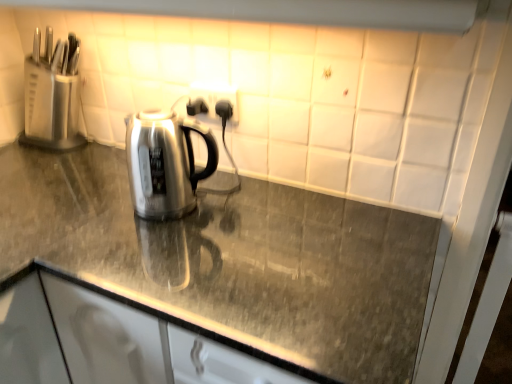
Question: Is black plastic outlet at center bigger than white glossy exhaust hood at upper center?

Choices:
 (A) no
 (B) yes

Answer: (A)

Question: Can you confirm if black plastic outlet at center is shorter than white glossy exhaust hood at upper center?

Choices:
 (A) yes
 (B) no

Answer: (B)

Question: From a real-world perspective, does black plastic outlet at center sit lower than white glossy exhaust hood at upper center?

Choices:
 (A) yes
 (B) no

Answer: (A)

Question: Are black plastic outlet at center and white glossy exhaust hood at upper center beside each other?

Choices:
 (A) no
 (B) yes

Answer: (A)

Question: Is black plastic outlet at center closer to camera compared to white glossy exhaust hood at upper center?

Choices:
 (A) yes
 (B) no

Answer: (B)

Question: Considering their positions, is white glossy exhaust hood at upper center located in front of or behind polished granite countertop at center?

Choices:
 (A) behind
 (B) front

Answer: (B)

Question: From a real-world perspective, is white glossy exhaust hood at upper center above or below polished granite countertop at center?

Choices:
 (A) above
 (B) below

Answer: (A)

Question: Considering the positions of white glossy exhaust hood at upper center and polished granite countertop at center in the image, is white glossy exhaust hood at upper center bigger or smaller than polished granite countertop at center?

Choices:
 (A) small
 (B) big

Answer: (A)

Question: Does point (371, 16) appear closer or farther from the camera than point (398, 294)?

Choices:
 (A) farther
 (B) closer

Answer: (B)

Question: From a real-world perspective, is polished granite countertop at center positioned above or below black plastic outlet at center?

Choices:
 (A) below
 (B) above

Answer: (A)

Question: Looking at the image, does polished granite countertop at center seem bigger or smaller compared to black plastic outlet at center?

Choices:
 (A) big
 (B) small

Answer: (A)

Question: Is point pyautogui.click(x=330, y=375) positioned closer to the camera than point pyautogui.click(x=236, y=119)?

Choices:
 (A) farther
 (B) closer

Answer: (B)

Question: From their relative heights in the image, would you say polished granite countertop at center is taller or shorter than black plastic outlet at center?

Choices:
 (A) short
 (B) tall

Answer: (B)

Question: Considering the positions of black plastic outlet at center and polished granite countertop at center in the image, is black plastic outlet at center bigger or smaller than polished granite countertop at center?

Choices:
 (A) big
 (B) small

Answer: (B)

Question: Considering the positions of black plastic outlet at center and polished granite countertop at center in the image, is black plastic outlet at center wider or thinner than polished granite countertop at center?

Choices:
 (A) thin
 (B) wide

Answer: (A)